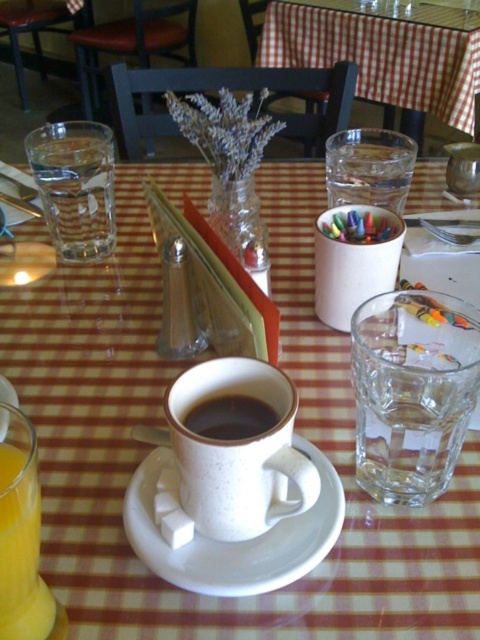
Question: Does translucent glass of orange juice at lower left appear over black matte cup at center?

Choices:
 (A) no
 (B) yes

Answer: (A)

Question: Which object appears closest to the camera in this image?

Choices:
 (A) speckled ceramic mug at center
 (B) translucent glass of orange juice at lower left
 (C) white speckled saucer at center
 (D) clear glass water at right

Answer: (B)

Question: Is white speckled saucer at center to the right of black matte cup at center from the viewer's perspective?

Choices:
 (A) no
 (B) yes

Answer: (B)

Question: Which point appears closest to the camera in this image?

Choices:
 (A) (215, 452)
 (B) (215, 435)

Answer: (A)

Question: Can you confirm if speckled ceramic mug at center is positioned above black matte cup at center?

Choices:
 (A) no
 (B) yes

Answer: (A)

Question: Among these objects, which one is farthest from the camera?

Choices:
 (A) speckled ceramic mug at center
 (B) white speckled saucer at center

Answer: (B)